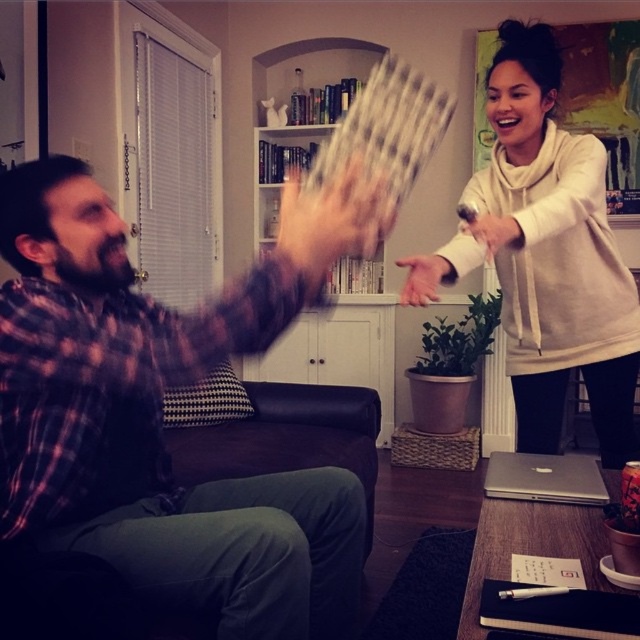
Image resolution: width=640 pixels, height=640 pixels. What are the coordinates of `plaid fabric shirt at left` in the screenshot? It's located at pyautogui.click(x=161, y=413).

Which is in front, point (348, 488) or point (502, 216)?

Point (348, 488) is in front.

I want to click on plaid fabric shirt at left, so click(161, 413).

You are a GUI agent. You are given a task and a screenshot of the screen. Output one action in this format:
    pyautogui.click(x=<x>, y=<y>)
    Task: Click on the plaid fabric shirt at left
    Image resolution: width=640 pixels, height=640 pixels.
    Given the screenshot: What is the action you would take?
    pyautogui.click(x=161, y=413)

Is white soft hoodie at upper right wider than matte white hand at center?

Yes.

The image size is (640, 640). I want to click on white soft hoodie at upper right, so click(x=547, y=256).

Where is `white soft hoodie at upper right`? white soft hoodie at upper right is located at coordinates (547, 256).

Is plaid fabric shirt at left shorter than white soft hoodie at upper right?

Yes, plaid fabric shirt at left is shorter than white soft hoodie at upper right.

Looking at this image, between plaid fabric shirt at left and white soft hoodie at upper right, which one has more height?

Standing taller between the two is white soft hoodie at upper right.

Who is more forward, (288, 230) or (586, 172)?

Point (288, 230) is in front.

I want to click on plaid fabric shirt at left, so click(161, 413).